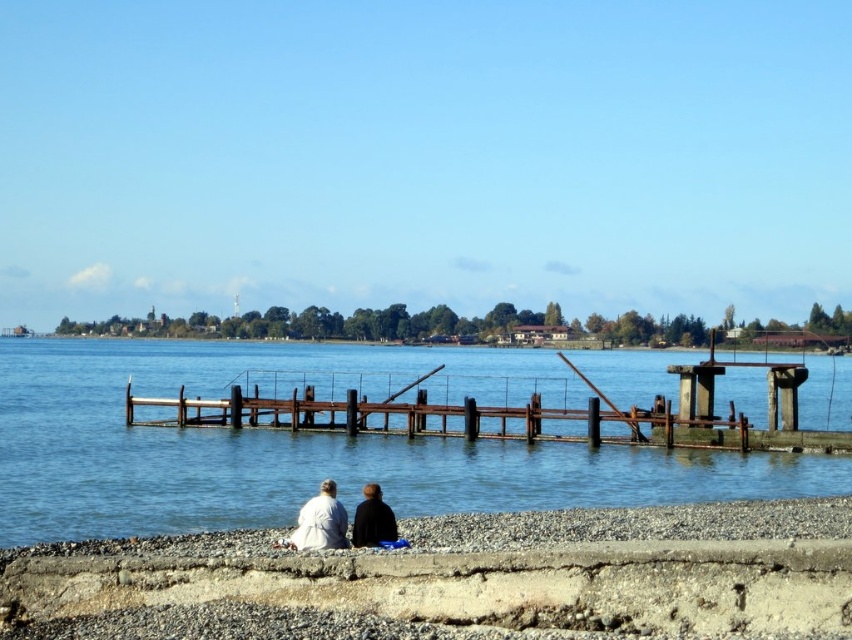
Question: Which of the following is the closest to the observer?

Choices:
 (A) (543, 381)
 (B) (320, 525)
 (C) (386, 509)

Answer: (B)

Question: Does blue water at center appear over rusty metal dock at center?

Choices:
 (A) yes
 (B) no

Answer: (A)

Question: Can you confirm if white fabric couple at lower center is positioned below dark brown leather jacket at lower center?

Choices:
 (A) no
 (B) yes

Answer: (A)

Question: From the image, what is the correct spatial relationship of blue water at center in relation to rusty metal dock at center?

Choices:
 (A) above
 (B) below

Answer: (A)

Question: Considering the real-world distances, which object is farthest from the rusty metal dock at center?

Choices:
 (A) dark brown leather jacket at lower center
 (B) white fabric couple at lower center

Answer: (B)

Question: Estimate the real-world distances between objects in this image. Which object is farther from the rusty metal dock at center?

Choices:
 (A) blue water at center
 (B) dark brown leather jacket at lower center
 (C) white fabric couple at lower center

Answer: (A)